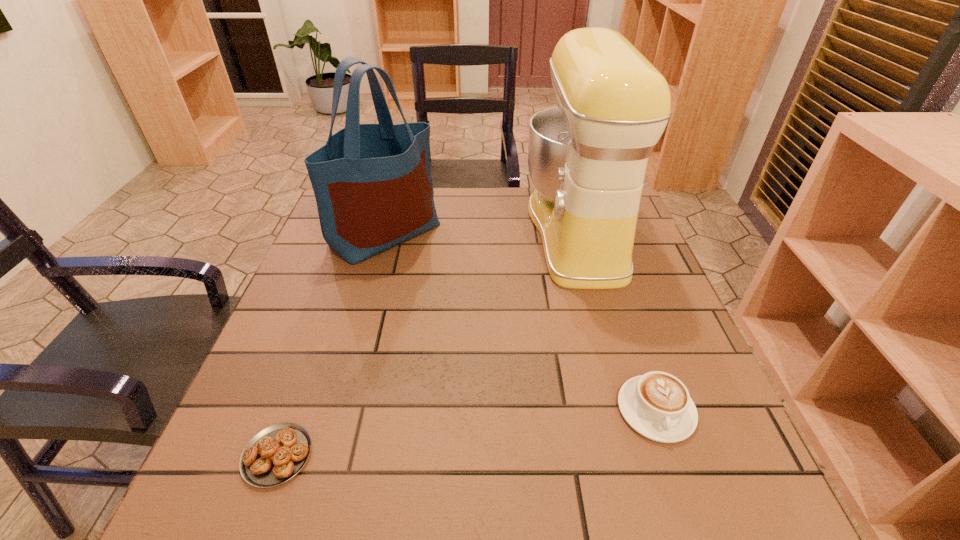
The width and height of the screenshot is (960, 540). I want to click on mixer that is positioned at the far edge, so click(x=587, y=157).

This screenshot has width=960, height=540. What are the coordinates of `handbag that is at the far edge` in the screenshot? It's located at (373, 187).

You are a GUI agent. You are given a task and a screenshot of the screen. Output one action in this format:
    pyautogui.click(x=<x>, y=<y>)
    Task: Click on the object that is positioned at the near edge
    The height and width of the screenshot is (540, 960).
    Given the screenshot: What is the action you would take?
    pyautogui.click(x=276, y=454)

Identify the location of handbag located in the left edge section of the desktop. 373,187.

At what (x,y) coordinates should I click in order to perform the action: click on pastry positioned at the left edge. Please return your answer as a coordinate pair (x, y). The image size is (960, 540). Looking at the image, I should click on [x=276, y=454].

The height and width of the screenshot is (540, 960). What are the coordinates of `mixer situated at the right edge` in the screenshot? It's located at (587, 157).

What are the coordinates of `cappuccino present at the right edge` in the screenshot? It's located at (657, 405).

Where is `object situated at the far left corner`? object situated at the far left corner is located at coordinates (373, 187).

Locate an element on the screen. This screenshot has height=540, width=960. object located at the near left corner is located at coordinates (276, 454).

Locate an element on the screen. object located in the far right corner section of the desktop is located at coordinates (587, 157).